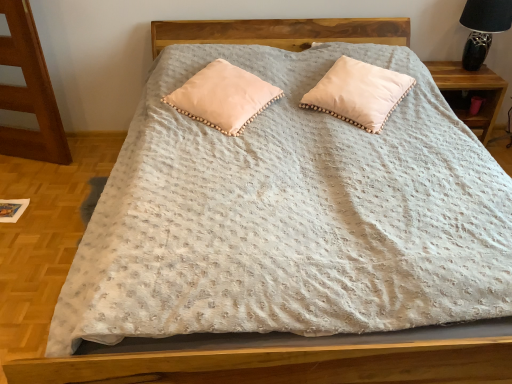
Question: From a real-world perspective, does wooden nightstand at right stand above peachy soft pillow at center, the first pillow positioned from the left?

Choices:
 (A) no
 (B) yes

Answer: (A)

Question: Is wooden nightstand at right bigger than peachy soft pillow at center, arranged as the 2th pillow when viewed from the right?

Choices:
 (A) no
 (B) yes

Answer: (B)

Question: Would you say wooden nightstand at right is a long distance from peachy soft pillow at center, arranged as the 2th pillow when viewed from the right?

Choices:
 (A) no
 (B) yes

Answer: (B)

Question: From the image's perspective, is wooden nightstand at right below peachy soft pillow at center, arranged as the 2th pillow when viewed from the right?

Choices:
 (A) yes
 (B) no

Answer: (B)

Question: Is wooden nightstand at right positioned with its back to peachy soft pillow at center, arranged as the 2th pillow when viewed from the right?

Choices:
 (A) no
 (B) yes

Answer: (A)

Question: Is wooden nightstand at right touching peachy soft pillow at center, arranged as the 2th pillow when viewed from the right?

Choices:
 (A) no
 (B) yes

Answer: (A)

Question: Does black ceramic table lamp at upper right have a larger size compared to peachy soft pillow at upper center, arranged as the first pillow when viewed from the right?

Choices:
 (A) no
 (B) yes

Answer: (A)

Question: Can you confirm if black ceramic table lamp at upper right is shorter than peachy soft pillow at upper center, the 2th pillow in the left-to-right sequence?

Choices:
 (A) yes
 (B) no

Answer: (B)

Question: Considering the relative positions of black ceramic table lamp at upper right and peachy soft pillow at upper center, arranged as the first pillow when viewed from the right, in the image provided, is black ceramic table lamp at upper right behind peachy soft pillow at upper center, arranged as the first pillow when viewed from the right,?

Choices:
 (A) no
 (B) yes

Answer: (B)

Question: From the image's perspective, does black ceramic table lamp at upper right appear lower than peachy soft pillow at upper center, the 2th pillow in the left-to-right sequence?

Choices:
 (A) no
 (B) yes

Answer: (A)

Question: Can you confirm if black ceramic table lamp at upper right is smaller than peachy soft pillow at upper center, arranged as the first pillow when viewed from the right?

Choices:
 (A) yes
 (B) no

Answer: (A)

Question: From a real-world perspective, is black ceramic table lamp at upper right beneath peachy soft pillow at upper center, arranged as the first pillow when viewed from the right?

Choices:
 (A) no
 (B) yes

Answer: (A)

Question: Does peachy soft pillow at center, arranged as the 2th pillow when viewed from the right, have a greater width compared to black ceramic table lamp at upper right?

Choices:
 (A) yes
 (B) no

Answer: (A)